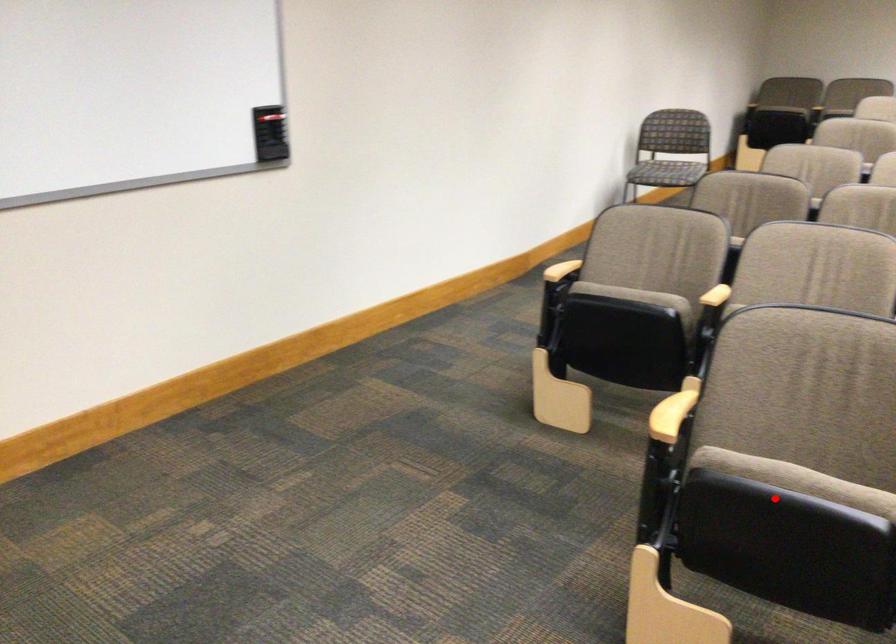
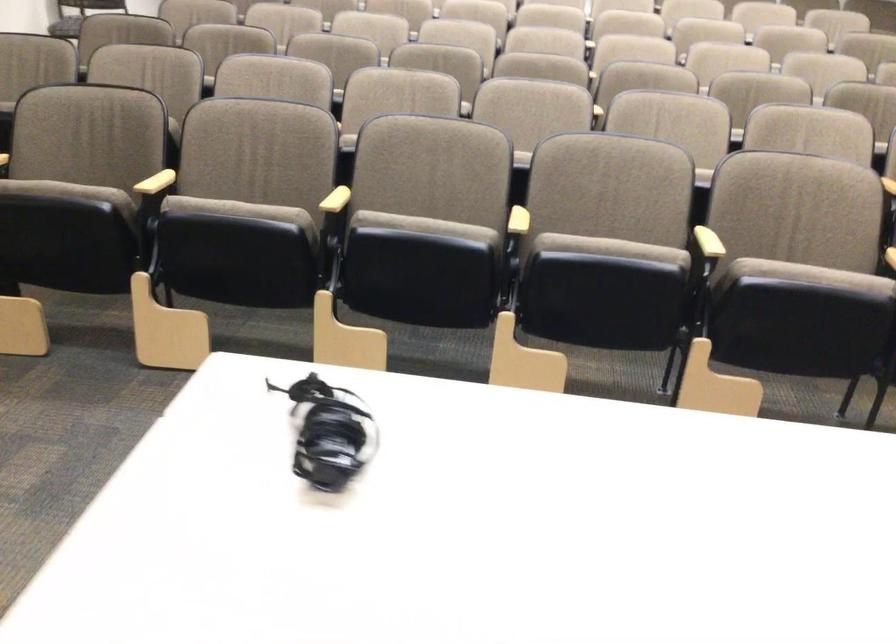
Question: I am providing you with two images of the same scene from different viewpoints. In image1, a red point is highlighted. Considering the same 3D point in image2, which of the following is correct?

Choices:
 (A) It is closer
 (B) It is farther

Answer: (B)